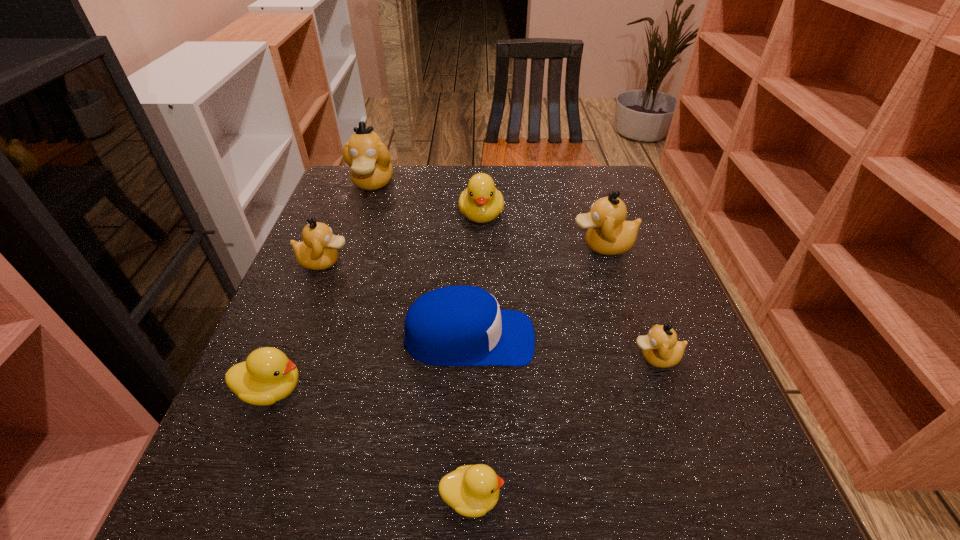
The image size is (960, 540). I want to click on the tallest duckling, so click(x=370, y=168).

This screenshot has width=960, height=540. I want to click on the tallest object, so click(370, 168).

I want to click on the third smallest tan duckling, so click(x=608, y=233).

Identify the location of the second tallest object. (608, 233).

I want to click on the farthest yellow duckling, so click(x=481, y=202).

Image resolution: width=960 pixels, height=540 pixels. Identify the location of the second smallest tan duckling. (318, 251).

Image resolution: width=960 pixels, height=540 pixels. I want to click on blue baseball cap, so click(459, 325).

The height and width of the screenshot is (540, 960). What are the coordinates of `the second farthest yellow duckling` in the screenshot? It's located at (267, 376).

Image resolution: width=960 pixels, height=540 pixels. What are the coordinates of `the leftmost yellow duckling` in the screenshot? It's located at (267, 376).

Locate an element on the screen. the nearest tan duckling is located at coordinates (661, 349).